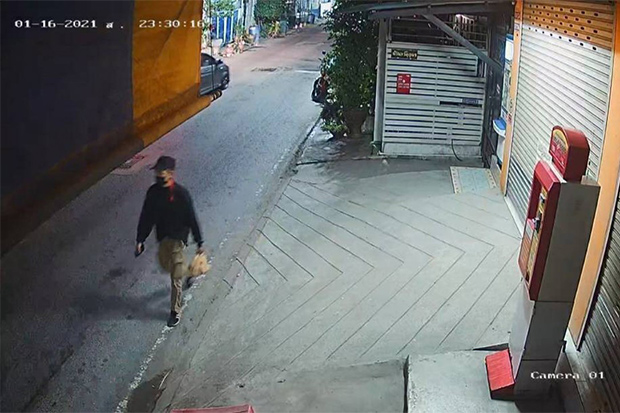
Locate an element on the screen. The height and width of the screenshot is (413, 620). black wall is located at coordinates (61, 119).